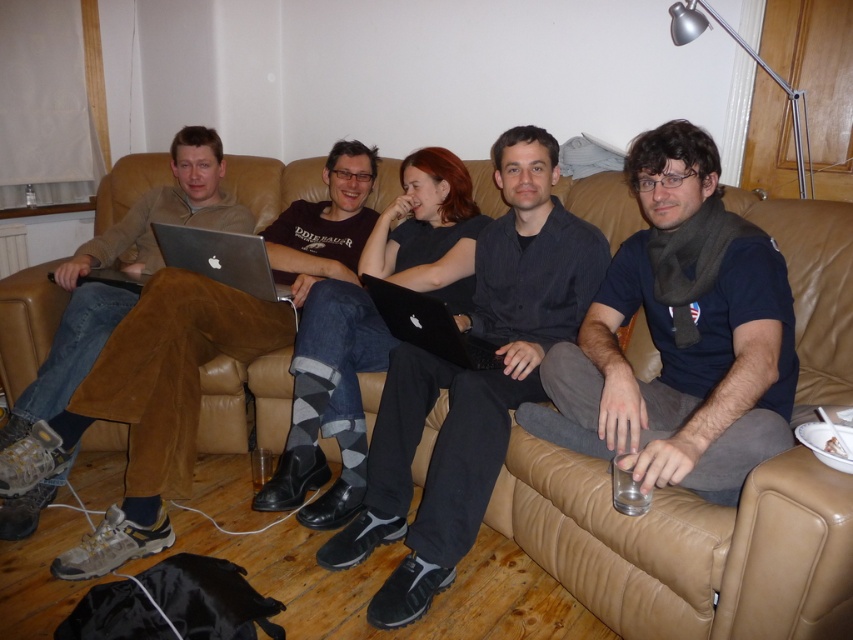
You are a photographer taking a picture of the scene. You notice the dark gray argyle socks at center and the matte black laptop at left. Which object should you focus on if you want to capture the larger one in your shot?

The dark gray argyle socks at center is larger in size than the matte black laptop at left, so you should focus on the dark gray argyle socks at center to capture the larger one in your shot.

You are a delivery robot with a package that needs to be placed between the matte silver laptop at center and the black matte laptop at center. The package is 20 inches long. Will the package fit between them?

The distance between the matte silver laptop at center and the black matte laptop at center is 21.05 inches. Since the package is 20 inches long, it will fit with approximately 1.05 inches of space remaining.